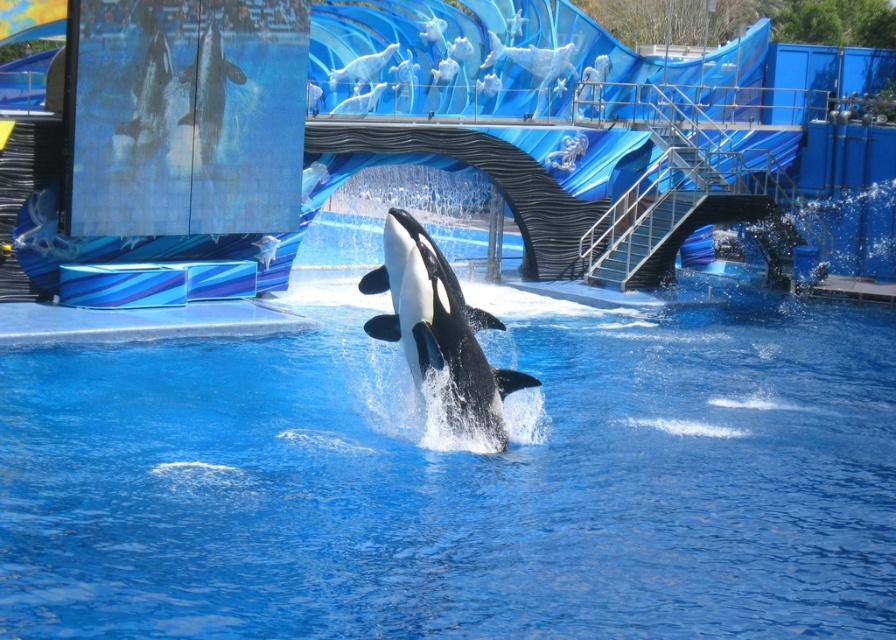
Question: Is black/white smooth orca at center wider than black smooth dolphin at upper left?

Choices:
 (A) no
 (B) yes

Answer: (A)

Question: Does black/white smooth orca at center appear under white smooth dolphin at upper left?

Choices:
 (A) no
 (B) yes

Answer: (B)

Question: Considering the real-world distances, which object is closest to the white smooth dolphin at upper left?

Choices:
 (A) black/white smooth orca at center
 (B) blue smooth water at center
 (C) black smooth dolphin at upper left

Answer: (C)

Question: Which of these objects is positioned farthest from the white smooth dolphin at upper left?

Choices:
 (A) black smooth dolphin at upper left
 (B) blue smooth water at center

Answer: (B)

Question: From the image, what is the correct spatial relationship of black/white smooth orca at center in relation to black smooth dolphin at upper left?

Choices:
 (A) left
 (B) right

Answer: (B)

Question: Which of the following is the farthest from the observer?

Choices:
 (A) (647, 552)
 (B) (185, 72)

Answer: (B)